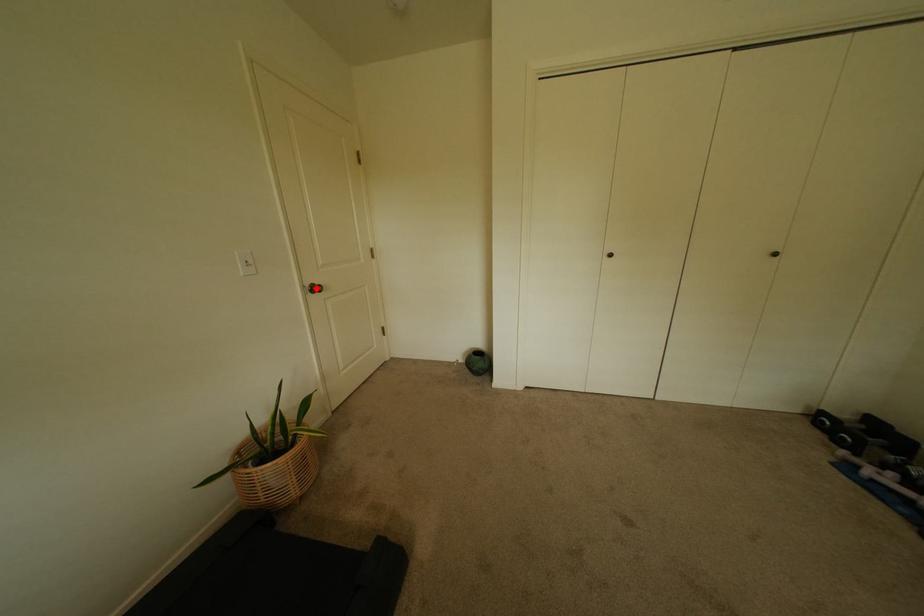
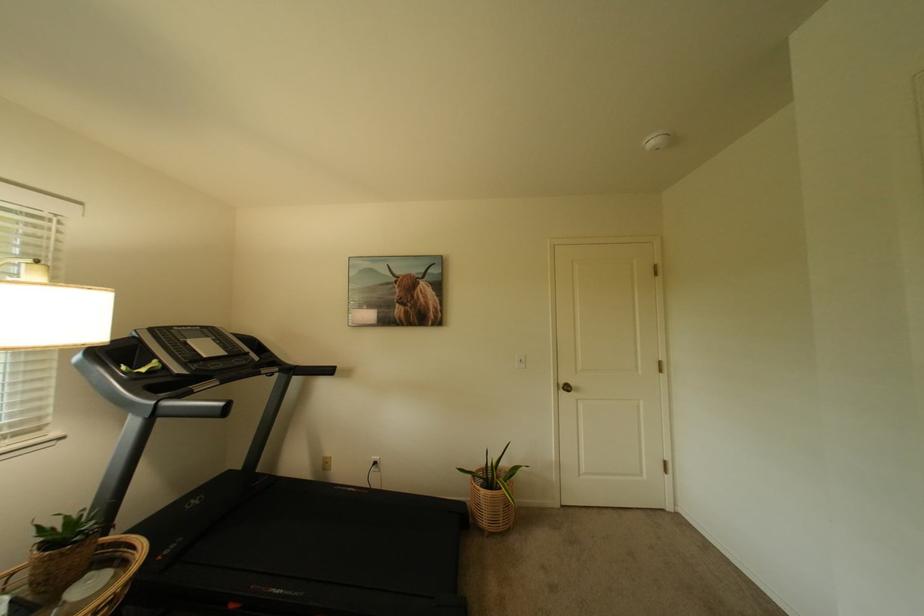
Where in the second image is the point corresponding to the highlighted location from the first image?

(569, 386)